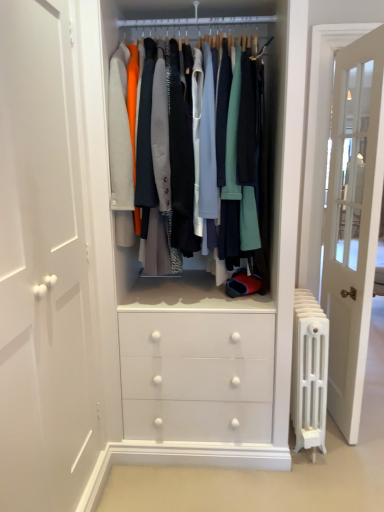
Question: Would you consider white metal radiator at right to be distant from matte white clothes at center?

Choices:
 (A) yes
 (B) no

Answer: (B)

Question: Is the position of white metal radiator at right more distant than that of matte white clothes at center?

Choices:
 (A) no
 (B) yes

Answer: (B)

Question: From the image's perspective, does white metal radiator at right appear lower than matte white clothes at center?

Choices:
 (A) no
 (B) yes

Answer: (B)

Question: Is white metal radiator at right shorter than matte white clothes at center?

Choices:
 (A) no
 (B) yes

Answer: (B)

Question: From the image's perspective, does white metal radiator at right appear higher than matte white clothes at center?

Choices:
 (A) yes
 (B) no

Answer: (B)

Question: Does white metal radiator at right lie in front of matte white clothes at center?

Choices:
 (A) no
 (B) yes

Answer: (A)

Question: Can you confirm if matte white clothes at center is positioned to the right of white glass door at right?

Choices:
 (A) no
 (B) yes

Answer: (A)

Question: Is the depth of matte white clothes at center greater than that of white glass door at right?

Choices:
 (A) no
 (B) yes

Answer: (A)

Question: From a real-world perspective, is matte white clothes at center beneath white glass door at right?

Choices:
 (A) yes
 (B) no

Answer: (B)

Question: Is matte white clothes at center bigger than white glass door at right?

Choices:
 (A) no
 (B) yes

Answer: (B)

Question: Can you confirm if matte white clothes at center is taller than white glass door at right?

Choices:
 (A) no
 (B) yes

Answer: (A)

Question: Is matte white clothes at center beside white glass door at right?

Choices:
 (A) no
 (B) yes

Answer: (A)

Question: Is matte white clothes at center shorter than white metal radiator at right?

Choices:
 (A) no
 (B) yes

Answer: (A)